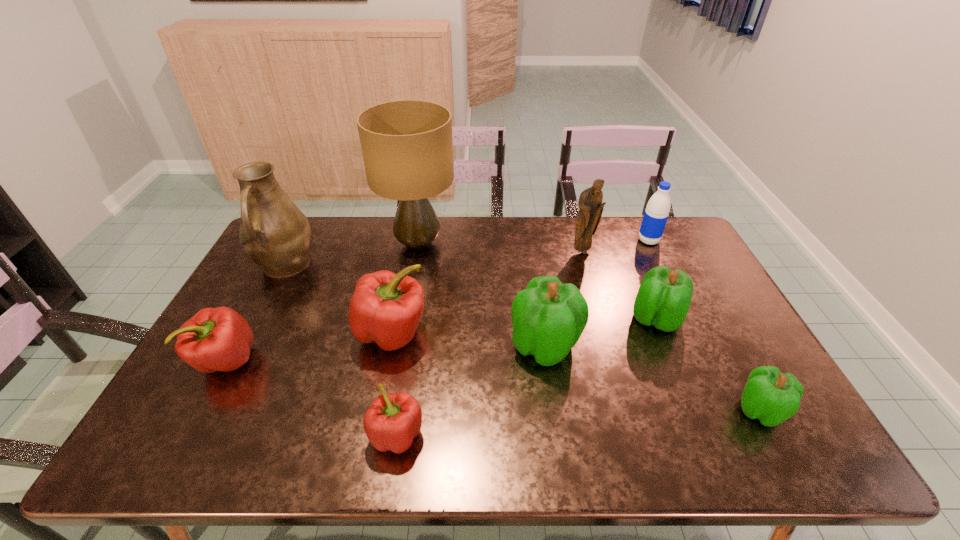
Identify the location of pitcher that is at the left edge. (274, 233).

Locate an element on the screen. This screenshot has width=960, height=540. bell pepper at the left edge is located at coordinates (215, 339).

Where is `water bottle present at the right edge`? The width and height of the screenshot is (960, 540). water bottle present at the right edge is located at coordinates (657, 210).

Where is `object that is at the far left corner`? Image resolution: width=960 pixels, height=540 pixels. object that is at the far left corner is located at coordinates (274, 233).

Locate an element on the screen. This screenshot has height=540, width=960. object that is positioned at the far right corner is located at coordinates (657, 210).

Identify the location of object located in the near right corner section of the desktop. (772, 397).

Locate an element on the screen. Image resolution: width=960 pixels, height=540 pixels. free location at the far edge is located at coordinates (480, 240).

The height and width of the screenshot is (540, 960). Identify the location of vacant space at the near edge of the desktop. (577, 462).

This screenshot has width=960, height=540. I want to click on vacant space at the left edge of the desktop, so click(258, 299).

In the image, there is a desktop. Find the location of `free region at the right edge`. free region at the right edge is located at coordinates (732, 422).